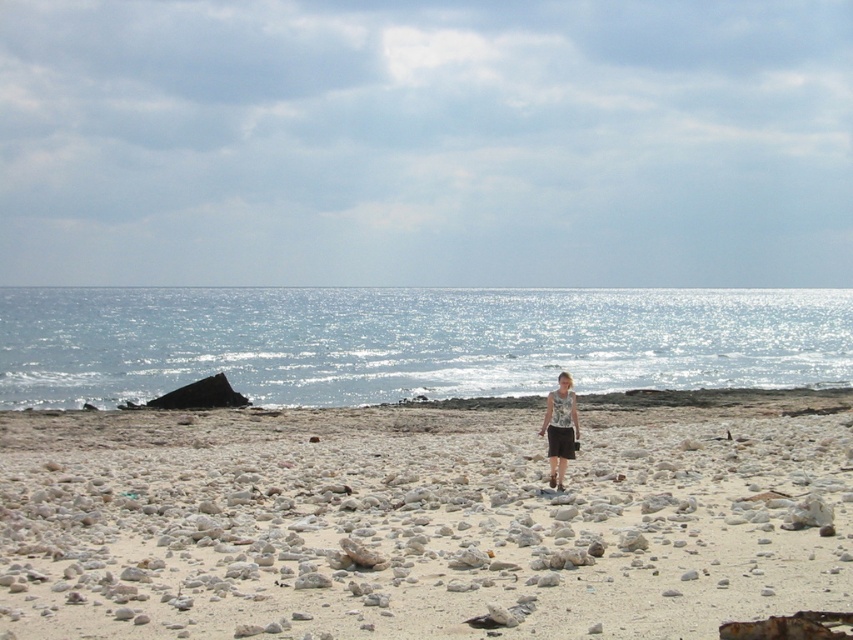
Question: Which of the following is the closest to the observer?

Choices:
 (A) white sandy beach at center
 (B) matte gray tank top at center

Answer: (A)

Question: Does glistening blue water at center have a larger size compared to matte gray tank top at center?

Choices:
 (A) yes
 (B) no

Answer: (A)

Question: Which point is farther to the camera?

Choices:
 (A) matte gray tank top at center
 (B) white sandy beach at center

Answer: (A)

Question: Which object appears farthest from the camera in this image?

Choices:
 (A) matte gray tank top at center
 (B) brown cotton shorts at center
 (C) white sandy beach at center

Answer: (B)

Question: Is matte gray tank top at center closer to camera compared to brown cotton shorts at center?

Choices:
 (A) no
 (B) yes

Answer: (B)

Question: Is white sandy beach at center smaller than brown cotton shorts at center?

Choices:
 (A) no
 (B) yes

Answer: (A)